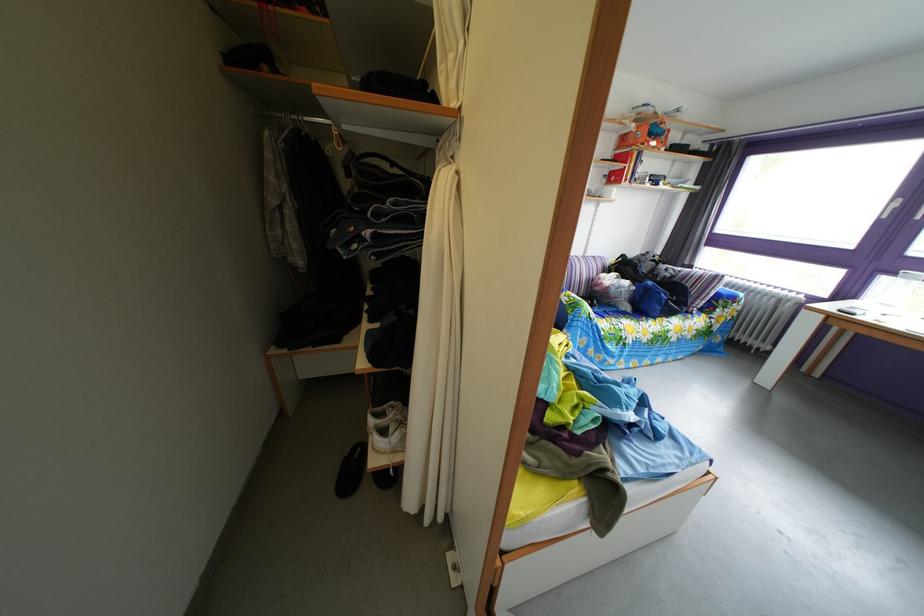
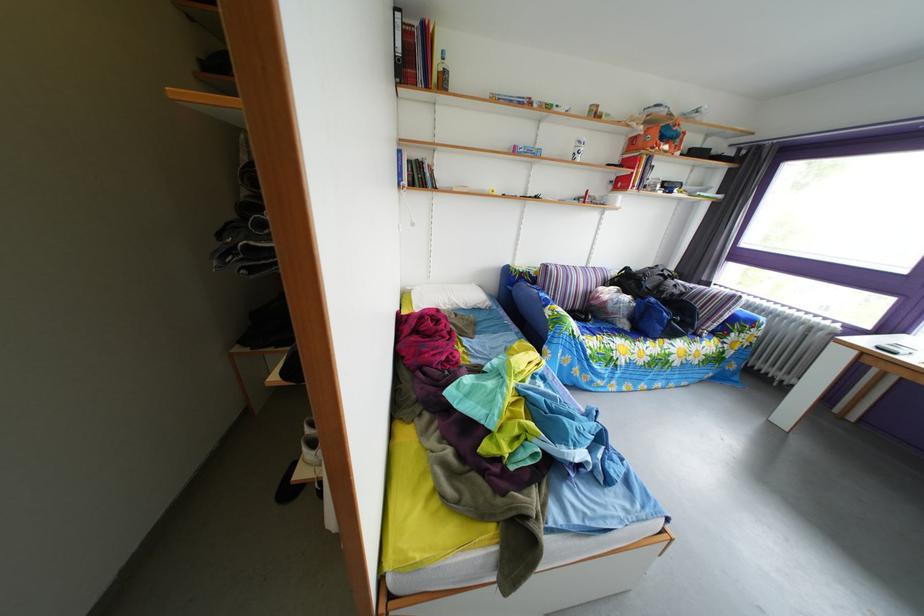
Locate, in the second image, the point that corresponds to (634,275) in the first image.

(638, 289)